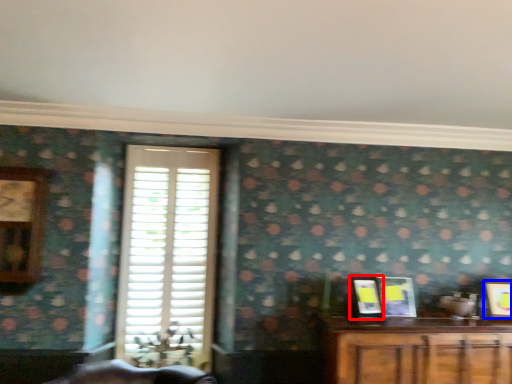
Question: Which point is further to the camera, picture frame (highlighted by a red box) or picture frame (highlighted by a blue box)?

Choices:
 (A) picture frame
 (B) picture frame

Answer: (B)